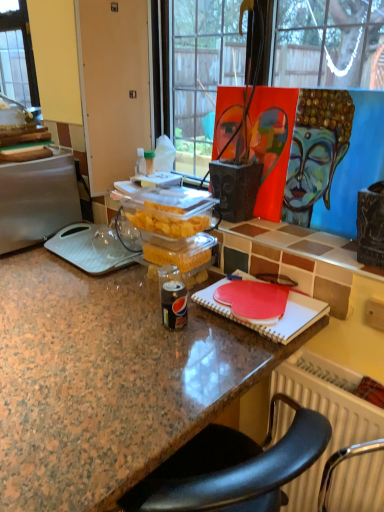
The image size is (384, 512). What do you see at coordinates (316, 150) in the screenshot?
I see `painted canvas at upper right` at bounding box center [316, 150].

Where is `silver metallic fridge at left`? The width and height of the screenshot is (384, 512). silver metallic fridge at left is located at coordinates (37, 199).

This screenshot has width=384, height=512. Identify the location of granite countertop at center. (107, 381).

From the image's perspective, which one is positioned lower, granite countertop at center or painted canvas at upper right?

granite countertop at center appears lower in the image.

Can you confirm if granite countertop at center is positioned to the left of painted canvas at upper right?

Yes.

Who is bigger, granite countertop at center or painted canvas at upper right?

granite countertop at center is bigger.

Looking at their sizes, would you say granite countertop at center is wider or thinner than painted canvas at upper right?

Clearly, granite countertop at center has more width compared to painted canvas at upper right.

Looking at this image, considering the relative sizes of painted canvas at upper right and silver metallic fridge at left in the image provided, is painted canvas at upper right thinner than silver metallic fridge at left?

Correct, the width of painted canvas at upper right is less than that of silver metallic fridge at left.

From a real-world perspective, is painted canvas at upper right physically above silver metallic fridge at left?

Correct, in the physical world, painted canvas at upper right is higher than silver metallic fridge at left.

Considering the relative sizes of painted canvas at upper right and silver metallic fridge at left in the image provided, is painted canvas at upper right bigger than silver metallic fridge at left?

Incorrect, painted canvas at upper right is not larger than silver metallic fridge at left.

Which object is further away from the camera taking this photo, painted canvas at upper right or silver metallic fridge at left?

silver metallic fridge at left is behind.

Between silver metallic fridge at left and painted canvas at upper right, which one appears on the left side from the viewer's perspective?

silver metallic fridge at left.

Is silver metallic fridge at left surrounding painted canvas at upper right?

That's incorrect, painted canvas at upper right is not inside silver metallic fridge at left.

Is silver metallic fridge at left not close to painted canvas at upper right?

No, silver metallic fridge at left is in close proximity to painted canvas at upper right.

Is point (33, 177) farther from viewer compared to point (333, 170)?

Yes, it is.

Is silver metallic fridge at left wider than granite countertop at center?

No, silver metallic fridge at left is not wider than granite countertop at center.

Does silver metallic fridge at left touch granite countertop at center?

They are not placed beside each other.

Measure the distance between silver metallic fridge at left and granite countertop at center.

The distance of silver metallic fridge at left from granite countertop at center is 47.90 centimeters.

Which is closer to the camera, (66, 202) or (195, 387)?

Point (66, 202) appears to be farther away from the viewer than point (195, 387).

How different are the orientations of painted canvas at upper right and granite countertop at center in degrees?

The angular difference between painted canvas at upper right and granite countertop at center is 90 degrees.

From the image's perspective, who appears lower, painted canvas at upper right or granite countertop at center?

granite countertop at center appears lower in the image.

Is painted canvas at upper right inside the boundaries of granite countertop at center, or outside?

painted canvas at upper right is not enclosed by granite countertop at center.

In the scene shown: Who is smaller, painted canvas at upper right or granite countertop at center?

painted canvas at upper right.

Choose the correct answer: Is granite countertop at center inside silver metallic fridge at left or outside it?

granite countertop at center is outside silver metallic fridge at left.

Is point (175, 407) positioned behind point (65, 155)?

No.

From a real-world perspective, does granite countertop at center sit lower than silver metallic fridge at left?

Yes, from a real-world perspective, granite countertop at center is below silver metallic fridge at left.

This screenshot has width=384, height=512. In order to click on desk on the left side of painted canvas at upper right in this screenshot , I will do `click(107, 381)`.

The height and width of the screenshot is (512, 384). What are the coordinates of `appliance below the painted canvas at upper right (from a real-world perspective)` in the screenshot? It's located at (37, 199).

Estimate the real-world distances between objects in this image. Which object is further from painted canvas at upper right, granite countertop at center or silver metallic fridge at left?

Among the two, silver metallic fridge at left is located further to painted canvas at upper right.

When comparing their distances from silver metallic fridge at left, does granite countertop at center or painted canvas at upper right seem further?

Based on the image, painted canvas at upper right appears to be further to silver metallic fridge at left.

From the picture: Looking at the image, which one is located closer to granite countertop at center, painted canvas at upper right or silver metallic fridge at left?

Among the two, silver metallic fridge at left is located nearer to granite countertop at center.

From the image, which object appears to be nearer to painted canvas at upper right, silver metallic fridge at left or granite countertop at center?

granite countertop at center is closer to painted canvas at upper right.

Considering their positions, is painted canvas at upper right positioned closer to silver metallic fridge at left than granite countertop at center?

granite countertop at center is positioned closer to the anchor silver metallic fridge at left.

When comparing their distances from granite countertop at center, does silver metallic fridge at left or painted canvas at upper right seem further?

Among the two, painted canvas at upper right is located further to granite countertop at center.

Where is `desk between silver metallic fridge at left and painted canvas at upper right`? This screenshot has width=384, height=512. desk between silver metallic fridge at left and painted canvas at upper right is located at coordinates (107, 381).